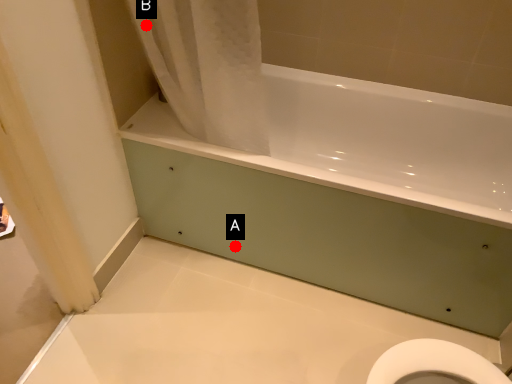
Question: Two points are circled on the image, labeled by A and B beside each circle. Which point appears farthest from the camera in this image?

Choices:
 (A) A is further
 (B) B is further

Answer: (A)